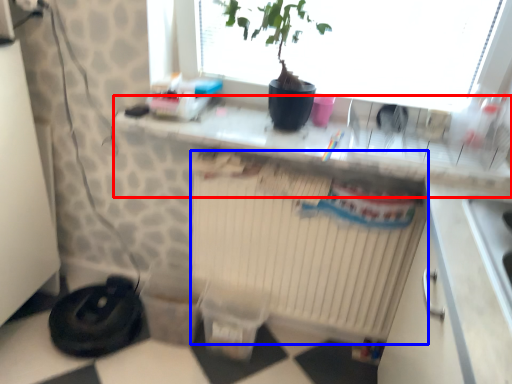
Question: Which object is further to the camera taking this photo, counter top (highlighted by a red box) or radiator (highlighted by a blue box)?

Choices:
 (A) counter top
 (B) radiator

Answer: (B)